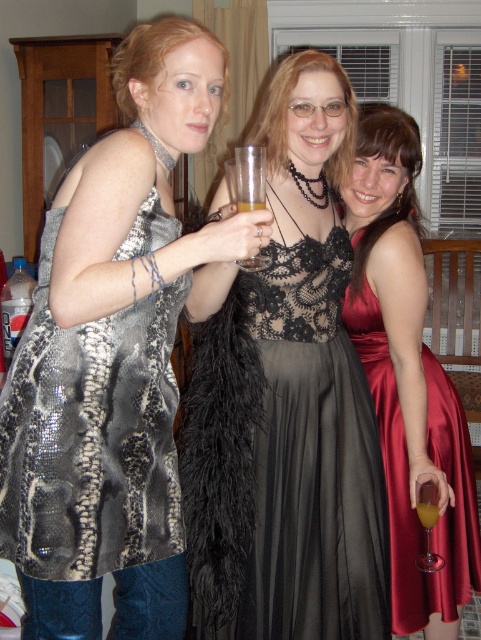
Question: Estimate the real-world distances between objects in this image. Which object is farther from the yellow translucent glass at center?

Choices:
 (A) shiny metallic dress at center
 (B) lace fabric dress at center
 (C) satin red dress at right

Answer: (A)

Question: Is lace fabric dress at center positioned at the back of translucent plastic cup at center?

Choices:
 (A) yes
 (B) no

Answer: (A)

Question: Which point is closer to the camera?

Choices:
 (A) (195, 556)
 (B) (400, 547)
 (C) (144, 156)
 (D) (423, 481)

Answer: (C)

Question: Which object is farther from the camera taking this photo?

Choices:
 (A) shiny metallic dress at center
 (B) lace fabric dress at center
 (C) satin red dress at right

Answer: (C)

Question: From the image, what is the correct spatial relationship of shiny metallic dress at center in relation to translucent plastic cup at center?

Choices:
 (A) above
 (B) below

Answer: (B)

Question: Is shiny metallic dress at center in front of translucent plastic cup at center?

Choices:
 (A) yes
 (B) no

Answer: (A)